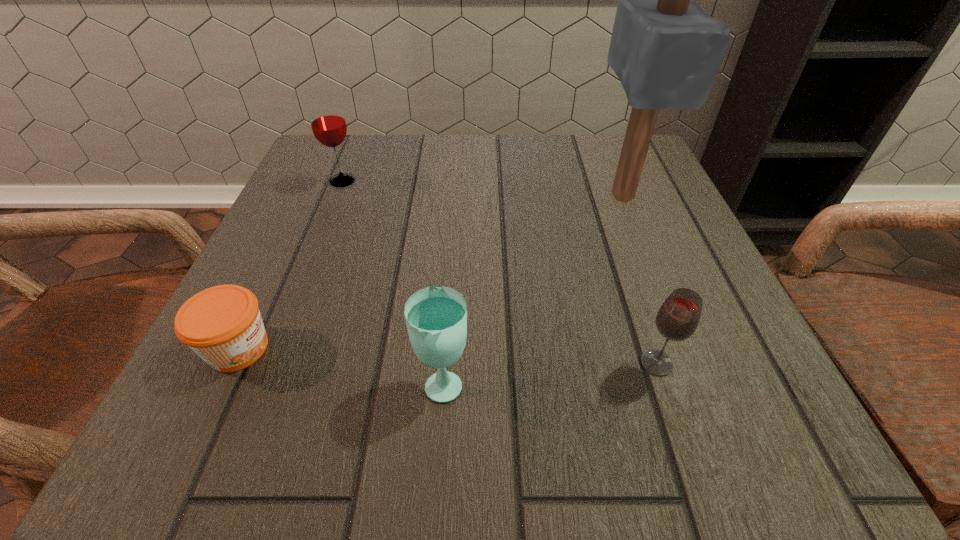
Find the location of a particular element. The height and width of the screenshot is (540, 960). mallet that is at the far edge is located at coordinates (666, 51).

Where is `glass present at the far edge`? The width and height of the screenshot is (960, 540). glass present at the far edge is located at coordinates (328, 124).

This screenshot has width=960, height=540. Find the location of `object that is positioned at the near edge`. object that is positioned at the near edge is located at coordinates (436, 317).

Locate an element on the screen. glass that is at the left edge is located at coordinates (328, 124).

This screenshot has height=540, width=960. In order to click on jam present at the left edge in this screenshot , I will do `click(222, 324)`.

Where is `mallet positioned at the right edge`? This screenshot has width=960, height=540. mallet positioned at the right edge is located at coordinates (666, 51).

Identify the location of glass drink container that is positioned at the right edge. (677, 319).

I want to click on object that is at the far left corner, so click(x=328, y=124).

Where is `object that is at the far right corner`? object that is at the far right corner is located at coordinates (666, 51).

The image size is (960, 540). What are the coordinates of `blank space at the far edge of the desktop` in the screenshot? It's located at (535, 178).